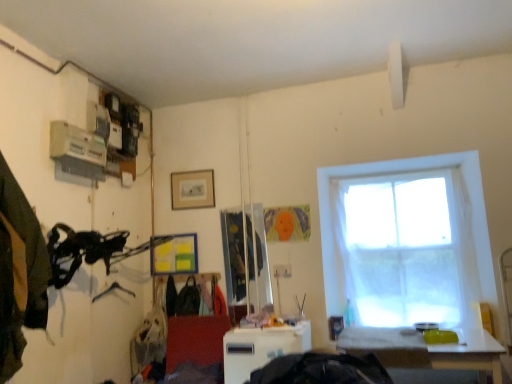
This screenshot has height=384, width=512. What are the coordinates of `free space above white sheer curtain at right (from a real-world perspective)` in the screenshot? It's located at (396, 177).